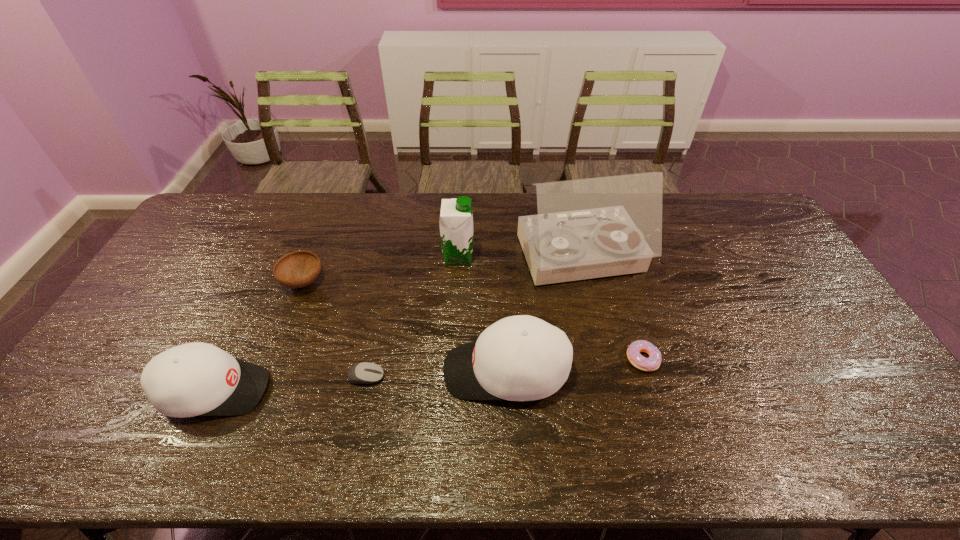
The width and height of the screenshot is (960, 540). What are the coordinates of `the left baseball cap` in the screenshot? It's located at tap(194, 379).

The image size is (960, 540). I want to click on the shorter baseball cap, so click(x=194, y=379).

Where is `the fifth shortest object`? The height and width of the screenshot is (540, 960). the fifth shortest object is located at coordinates (519, 358).

Locate an element on the screen. the taller baseball cap is located at coordinates pyautogui.click(x=519, y=358).

Locate an element on the screen. The height and width of the screenshot is (540, 960). the third shortest object is located at coordinates (x=298, y=269).

You are a GUI agent. You are given a task and a screenshot of the screen. Output one action in this format:
    pyautogui.click(x=<x>, y=<y>)
    Task: Click on the tallest object
    This screenshot has height=540, width=960.
    Given the screenshot: What is the action you would take?
    pyautogui.click(x=588, y=228)

You are a GUI agent. You are given a task and a screenshot of the screen. Output one action in this format:
    pyautogui.click(x=<x>, y=<y>)
    Task: Click on the soya milk
    
    Given the screenshot: What is the action you would take?
    pyautogui.click(x=456, y=218)

Identify the location of the third object from left to right. (361, 373).

Find the location of a particular element. The image size is (960, 540). doughnut is located at coordinates (653, 362).

Where is `vacant region located on the front-facing side of the fourth shortest object`? The width and height of the screenshot is (960, 540). vacant region located on the front-facing side of the fourth shortest object is located at coordinates (389, 390).